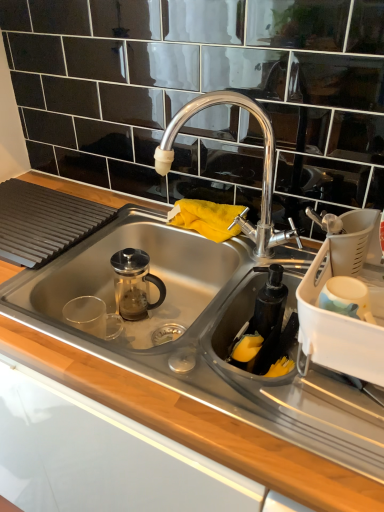
Question: Is stainless steel sink at center touching polished chrome faucet at center?

Choices:
 (A) no
 (B) yes

Answer: (A)

Question: Is stainless steel sink at center facing away from polished chrome faucet at center?

Choices:
 (A) yes
 (B) no

Answer: (B)

Question: Is stainless steel sink at center taller than polished chrome faucet at center?

Choices:
 (A) no
 (B) yes

Answer: (A)

Question: Is stainless steel sink at center in front of polished chrome faucet at center?

Choices:
 (A) yes
 (B) no

Answer: (A)

Question: Does stainless steel sink at center have a greater width compared to polished chrome faucet at center?

Choices:
 (A) yes
 (B) no

Answer: (A)

Question: Considering the relative positions of stainless steel sink at center and polished chrome faucet at center in the image provided, is stainless steel sink at center to the right of polished chrome faucet at center from the viewer's perspective?

Choices:
 (A) yes
 (B) no

Answer: (B)

Question: Is black matte soap dispenser at lower right, the second appliance positioned from the right, smaller than polished chrome faucet at center?

Choices:
 (A) yes
 (B) no

Answer: (A)

Question: Is polished chrome faucet at center completely or partially inside black matte soap dispenser at lower right, the second appliance positioned from the right?

Choices:
 (A) no
 (B) yes

Answer: (A)

Question: Is black matte soap dispenser at lower right, the 1th appliance viewed from the left, far from polished chrome faucet at center?

Choices:
 (A) no
 (B) yes

Answer: (A)

Question: Is black matte soap dispenser at lower right, the second appliance positioned from the right, to the left of polished chrome faucet at center from the viewer's perspective?

Choices:
 (A) yes
 (B) no

Answer: (B)

Question: Could you tell me if black matte soap dispenser at lower right, the second appliance positioned from the right, is turned towards polished chrome faucet at center?

Choices:
 (A) yes
 (B) no

Answer: (B)

Question: Is black matte soap dispenser at lower right, the 1th appliance viewed from the left, positioned with its back to polished chrome faucet at center?

Choices:
 (A) no
 (B) yes

Answer: (B)

Question: Is stainless steel sink at center not inside white plastic dish rack at right, which is the first appliance in right-to-left order?

Choices:
 (A) no
 (B) yes

Answer: (B)